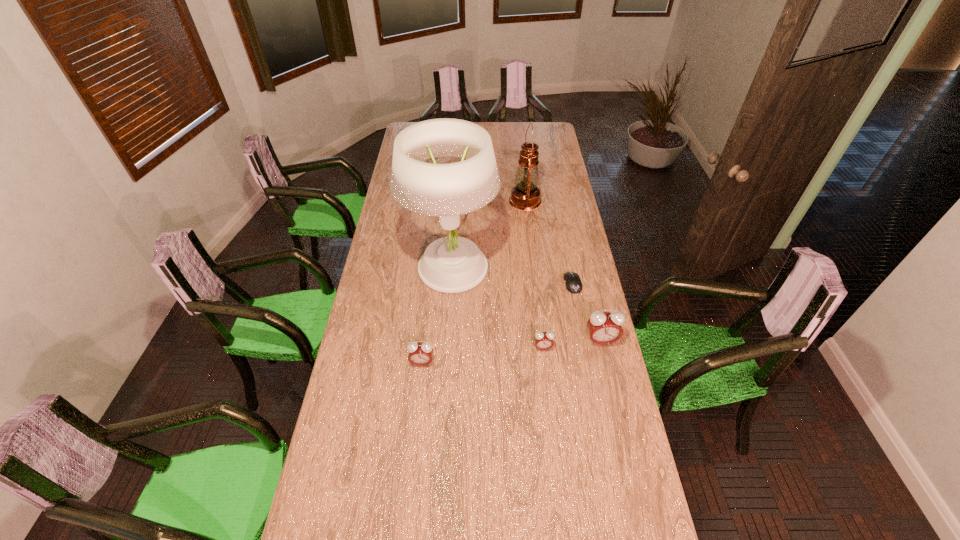
This screenshot has height=540, width=960. What are the coordinates of `free spot located 0.160m on the clock face of the nearest object` in the screenshot? It's located at click(x=417, y=411).

The height and width of the screenshot is (540, 960). In order to click on free location located on the clock face of the fifth tallest object in this screenshot , I will do `click(549, 403)`.

This screenshot has width=960, height=540. What are the coordinates of `free location located on the clock face of the rightmost alarm clock` in the screenshot? It's located at (628, 455).

Where is `vacant space located 0.190m on the left of the oil lamp`? vacant space located 0.190m on the left of the oil lamp is located at coordinates (470, 201).

Find the location of a particular element. The height and width of the screenshot is (540, 960). vacant area situated on the front-facing side of the lamp is located at coordinates (445, 363).

You are a GUI agent. You are given a task and a screenshot of the screen. Output one action in this format:
    pyautogui.click(x=<x>, y=<y>)
    Task: Click on the vacant region located on the front of the computer equipment
    The image size is (960, 540).
    Given the screenshot: What is the action you would take?
    pyautogui.click(x=590, y=374)

This screenshot has height=540, width=960. Identify the location of object that is at the left edge. (452, 264).

Locate an element on the screen. The width and height of the screenshot is (960, 540). alarm clock located in the right edge section of the desktop is located at coordinates (604, 327).

The width and height of the screenshot is (960, 540). In order to click on oil lamp present at the right edge in this screenshot , I will do `click(525, 195)`.

In order to click on computer equipment present at the right edge in this screenshot , I will do `click(572, 280)`.